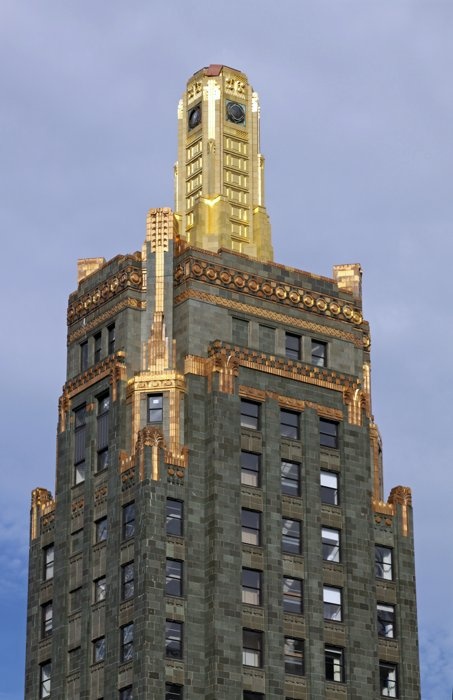
This screenshot has height=700, width=453. In order to click on gold framing in this screenshot , I will do `click(157, 383)`.